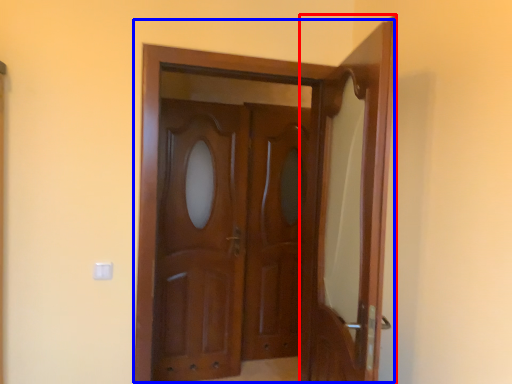
Question: Among these objects, which one is farthest to the camera, door (highlighted by a red box) or door (highlighted by a blue box)?

Choices:
 (A) door
 (B) door

Answer: (B)